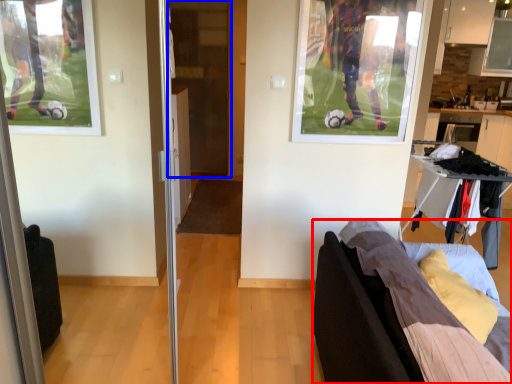
Question: Which point is further to the camera, furniture (highlighted by a red box) or screen door (highlighted by a blue box)?

Choices:
 (A) furniture
 (B) screen door

Answer: (B)